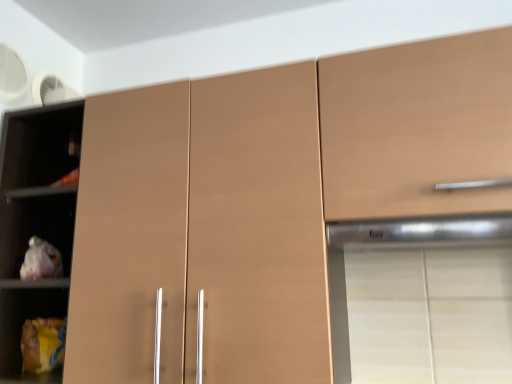
Question: Considering the relative positions of satin silver exhaust hood at upper right and matte brown cabinet at upper right in the image provided, is satin silver exhaust hood at upper right to the right of matte brown cabinet at upper right from the viewer's perspective?

Choices:
 (A) yes
 (B) no

Answer: (B)

Question: From a real-world perspective, does satin silver exhaust hood at upper right stand above matte brown cabinet at upper right?

Choices:
 (A) no
 (B) yes

Answer: (A)

Question: Is satin silver exhaust hood at upper right positioned before matte brown cabinet at upper right?

Choices:
 (A) no
 (B) yes

Answer: (A)

Question: Is satin silver exhaust hood at upper right in contact with matte brown cabinet at upper right?

Choices:
 (A) yes
 (B) no

Answer: (B)

Question: Can you confirm if satin silver exhaust hood at upper right is wider than matte brown cabinet at upper right?

Choices:
 (A) yes
 (B) no

Answer: (B)

Question: Is satin silver exhaust hood at upper right outside of matte brown cabinet at upper right?

Choices:
 (A) no
 (B) yes

Answer: (B)

Question: Can you confirm if matte brown cupboard at left is smaller than matte brown cabinet at upper right?

Choices:
 (A) no
 (B) yes

Answer: (A)

Question: Considering the relative sizes of matte brown cupboard at left and matte brown cabinet at upper right in the image provided, is matte brown cupboard at left thinner than matte brown cabinet at upper right?

Choices:
 (A) no
 (B) yes

Answer: (B)

Question: From a real-world perspective, is matte brown cupboard at left over matte brown cabinet at upper right?

Choices:
 (A) yes
 (B) no

Answer: (B)

Question: Could you tell me if matte brown cupboard at left is facing matte brown cabinet at upper right?

Choices:
 (A) no
 (B) yes

Answer: (A)

Question: From the image's perspective, does matte brown cupboard at left appear lower than matte brown cabinet at upper right?

Choices:
 (A) yes
 (B) no

Answer: (A)

Question: Is matte brown cupboard at left further to the viewer compared to matte brown cabinet at upper right?

Choices:
 (A) no
 (B) yes

Answer: (B)

Question: Is satin silver exhaust hood at upper right in contact with matte brown cupboard at left?

Choices:
 (A) no
 (B) yes

Answer: (A)